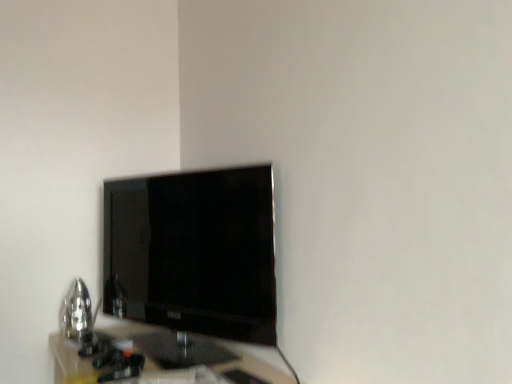
Where is `matte black tv at upper left`? This screenshot has width=512, height=384. matte black tv at upper left is located at coordinates (193, 253).

This screenshot has width=512, height=384. Describe the element at coordinates (193, 253) in the screenshot. I see `matte black tv at upper left` at that location.

I want to click on matte black tv at upper left, so click(x=193, y=253).